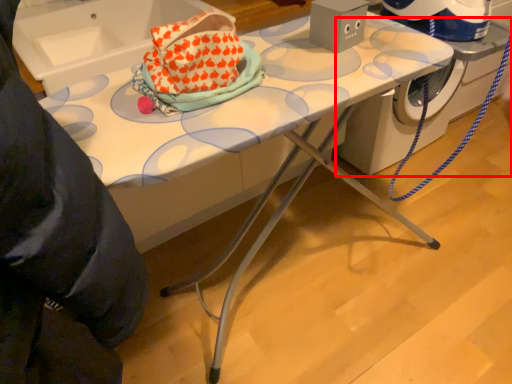
Question: Where is machine (annotated by the red box) located in relation to sink in the image?

Choices:
 (A) left
 (B) right

Answer: (B)